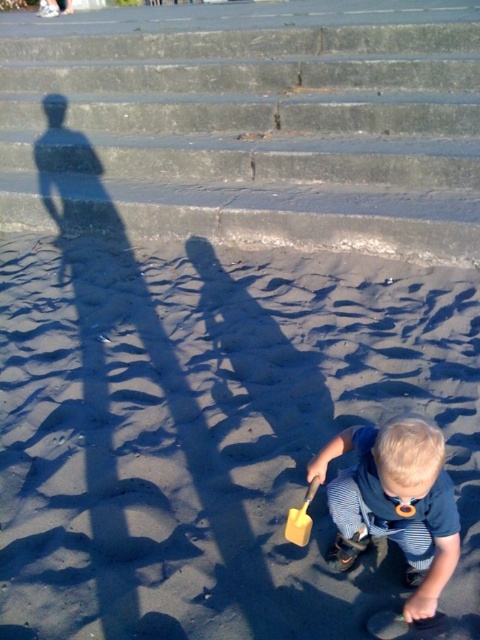
Question: Among these objects, which one is farthest from the camera?

Choices:
 (A) blue striped shirt at lower center
 (B) fine-grained sand at lower center

Answer: (B)

Question: Does concrete stairs at upper center appear over yellow matte shovel at lower center?

Choices:
 (A) yes
 (B) no

Answer: (A)

Question: Estimate the real-world distances between objects in this image. Which object is farther from the yellow matte shovel at lower center?

Choices:
 (A) concrete stairs at upper center
 (B) fine-grained sand at lower center

Answer: (A)

Question: Considering the relative positions of blue striped shirt at lower center and yellow matte shovel at lower center in the image provided, where is blue striped shirt at lower center located with respect to yellow matte shovel at lower center?

Choices:
 (A) left
 (B) right

Answer: (B)

Question: Which is nearer to the fine-grained sand at lower center?

Choices:
 (A) concrete stairs at upper center
 (B) blue striped shirt at lower center
 (C) yellow matte shovel at lower center

Answer: (B)

Question: Does fine-grained sand at lower center have a lesser width compared to concrete stairs at upper center?

Choices:
 (A) yes
 (B) no

Answer: (A)